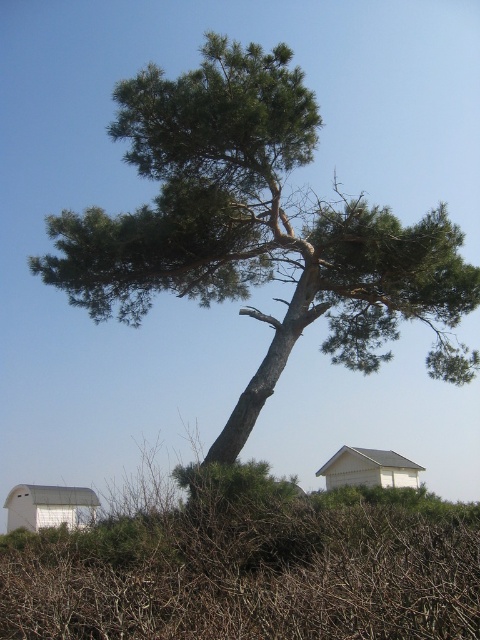
Question: Among these objects, which one is farthest from the camera?

Choices:
 (A) brown dry bush at center
 (B) white matte hut at lower left
 (C) green needle-like tree at center
 (D) white matte house at center

Answer: (D)

Question: Is white matte hut at lower left smaller than white matte house at center?

Choices:
 (A) no
 (B) yes

Answer: (B)

Question: Can you confirm if green needle-like tree at center is positioned to the left of white matte hut at lower left?

Choices:
 (A) yes
 (B) no

Answer: (B)

Question: From the image, what is the correct spatial relationship of green needle-like tree at center in relation to white matte house at center?

Choices:
 (A) left
 (B) right

Answer: (A)

Question: Which point is closer to the camera?

Choices:
 (A) (3, 602)
 (B) (9, 520)
 (C) (336, 458)

Answer: (A)

Question: Which object appears farthest from the camera in this image?

Choices:
 (A) brown dry bush at center
 (B) white matte hut at lower left
 (C) green needle-like tree at center
 (D) white matte house at center

Answer: (D)